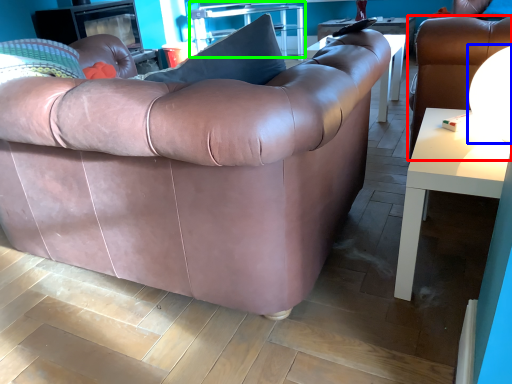
Question: Based on their relative distances, which object is farther from chair (highlighted by a red box)? Choose from lamp (highlighted by a blue box) and table (highlighted by a green box).

Choices:
 (A) lamp
 (B) table

Answer: (B)